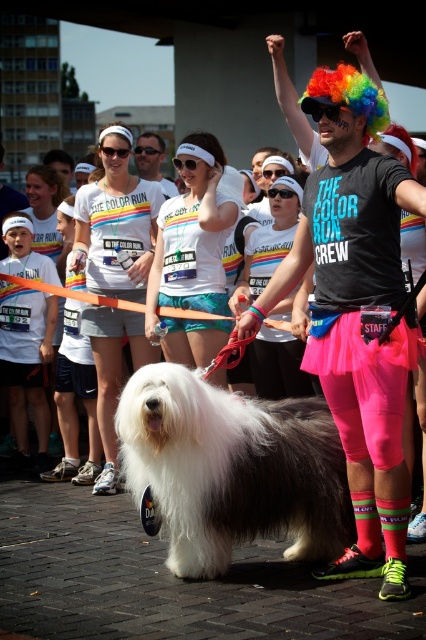
Can you confirm if white fluffy dog at center is bigger than matte white shirt at center?

No.

Who is more distant from viewer, [241,481] or [140,172]?

The point [140,172] is behind.

Does point (181, 536) come in front of point (166, 188)?

That is True.

Locate an element on the screen. Image resolution: width=426 pixels, height=640 pixels. white fluffy dog at center is located at coordinates (232, 468).

Is neon pink spandex at center to the left of matte white shirt at center from the viewer's perspective?

In fact, neon pink spandex at center is to the right of matte white shirt at center.

Does neon pink spandex at center have a lesser width compared to matte white shirt at center?

Yes.

Locate an element on the screen. Image resolution: width=426 pixels, height=640 pixels. neon pink spandex at center is located at coordinates (356, 312).

I want to click on neon pink spandex at center, so click(x=356, y=312).

Is neon pink spandex at center to the right of white fluffy dog at center from the viewer's perspective?

Indeed, neon pink spandex at center is positioned on the right side of white fluffy dog at center.

Who is more distant from viewer, (368,260) or (189,563)?

The point (189,563) is more distant.

Locate an element on the screen. neon pink spandex at center is located at coordinates (x=356, y=312).